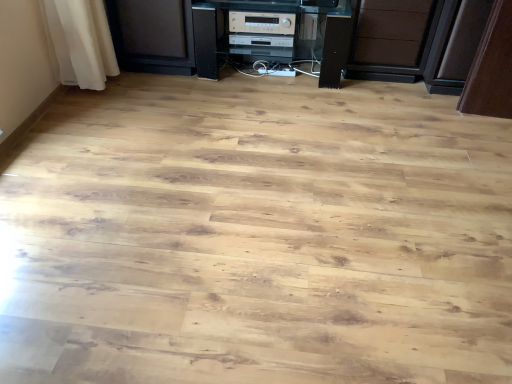
The width and height of the screenshot is (512, 384). I want to click on free area below black plastic stereo at center (from a real-world perspective), so click(271, 77).